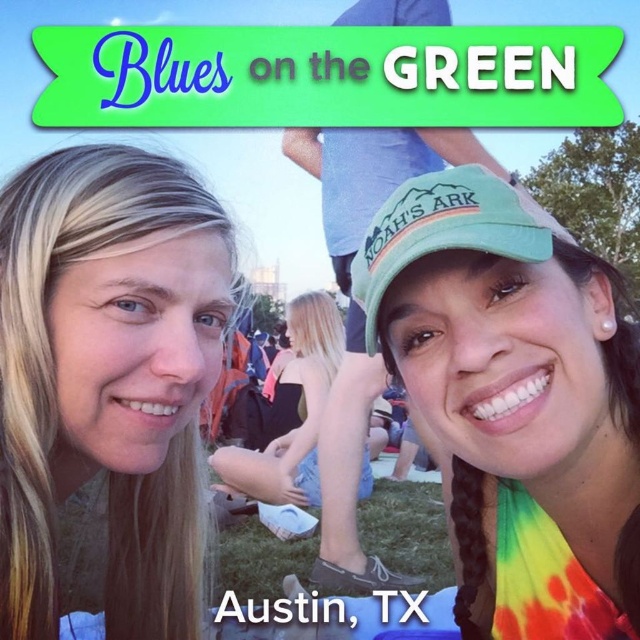
You are a photographer at the Blues on the Green festival in Austin, Texas. You need to capture a photo where the blonde hair at left and the green fabric baseball cap at center are both visible. Based on their positions, which object is lower in the frame?

The blonde hair at left is below the green fabric baseball cap at center, so the blonde hair at left is lower in the frame.

You are a photographer trying to capture both the green fabric cap at right and the green fabric baseball cap at center in a single frame. Based on their widths, which cap should you adjust your camera angle to focus on to ensure both fit in the shot?

The green fabric cap at right might be wider than the green fabric baseball cap at center, so you should focus on the wider cap to ensure both fit in the shot.